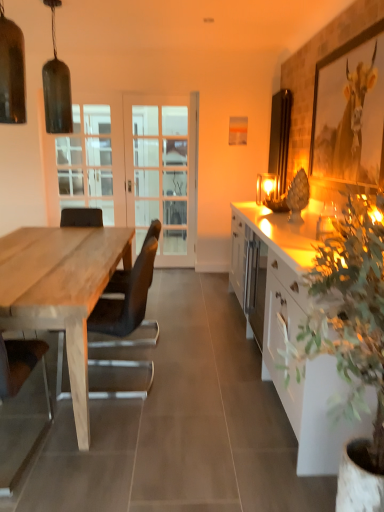
What do you see at coordinates (238, 130) in the screenshot? I see `matte wooden picture frame at upper center, which appears as the 2th picture frame when viewed from the front` at bounding box center [238, 130].

This screenshot has width=384, height=512. What do you see at coordinates (12, 72) in the screenshot? I see `matte glass pendant light at upper left, positioned as the 3th lamp in back-to-front order` at bounding box center [12, 72].

This screenshot has height=512, width=384. Describe the element at coordinates (127, 305) in the screenshot. I see `black leather chair at left, the 2th chair viewed from the front` at that location.

This screenshot has width=384, height=512. What do you see at coordinates (161, 173) in the screenshot?
I see `white glass screen door at center, which is the second screen door in left-to-right order` at bounding box center [161, 173].

You are a GUI agent. You are given a task and a screenshot of the screen. Output one action in this format:
    pyautogui.click(x=<x>, y=<y>)
    Task: Click on the clear glass door at center, marked as the 1th screen door in a left-to-right arrangement
    The width and height of the screenshot is (384, 512).
    Given the screenshot: What is the action you would take?
    pyautogui.click(x=135, y=168)

Identify the location of matte wooden picture frame at upper center, which appears as the 2th picture frame when viewed from the front. (238, 130).

Does white glossy cabinet at right appear on the left side of clear glass door at center, marked as the 1th screen door in a left-to-right arrangement?

No.

How distant is white glossy cabinet at right from clear glass door at center, which ranks as the 2th screen door in right-to-left order?

A distance of 7.39 feet exists between white glossy cabinet at right and clear glass door at center, which ranks as the 2th screen door in right-to-left order.

Which is in front, point (318, 474) or point (88, 190)?

The point (318, 474) is closer to the camera.

Considering the sizes of objects white glossy cabinet at right and clear glass door at center, which ranks as the 2th screen door in right-to-left order, in the image provided, who is shorter, white glossy cabinet at right or clear glass door at center, which ranks as the 2th screen door in right-to-left order,?

white glossy cabinet at right is shorter.

From the image's perspective, relative to metallic gold picture frame at upper right, acting as the second picture frame starting from the left, is matte glass pendant light at upper left, which is counted as the 2th lamp, starting from the right, above or below?

From the image's perspective, matte glass pendant light at upper left, which is counted as the 2th lamp, starting from the right, appears above metallic gold picture frame at upper right, acting as the second picture frame starting from the left.

Is metallic gold picture frame at upper right, positioned as the first picture frame in front-to-back order, at the back of matte glass pendant light at upper left, placed as the 1th lamp when sorted from front to back?

Yes.

From a real-world perspective, is matte glass pendant light at upper left, which is counted as the 2th lamp, starting from the right, on metallic gold picture frame at upper right, the 2th picture frame from the back?

Yes, from a real-world perspective, matte glass pendant light at upper left, which is counted as the 2th lamp, starting from the right, is on top of metallic gold picture frame at upper right, the 2th picture frame from the back.

From a real-world perspective, does matte glass lamp at upper right, the first lamp positioned from the right, stand above brown leather chair at left, acting as the first chair starting from the front?

Yes.

Looking at the image, does matte glass lamp at upper right, which is counted as the third lamp, starting from the front, seem bigger or smaller compared to brown leather chair at left, acting as the first chair starting from the front?

matte glass lamp at upper right, which is counted as the third lamp, starting from the front, is smaller than brown leather chair at left, acting as the first chair starting from the front.

Which object is closer to the camera taking this photo, matte glass lamp at upper right, the first lamp positioned from the right, or brown leather chair at left, acting as the first chair starting from the front?

brown leather chair at left, acting as the first chair starting from the front, is more forward.

Is matte glass lamp at upper right, the 3th lamp from the left, looking in the opposite direction of brown leather chair at left, acting as the first chair starting from the front?

No, matte glass lamp at upper right, the 3th lamp from the left, is not facing the opposite direction of brown leather chair at left, acting as the first chair starting from the front.

From the picture: What's the angular difference between brown leather chair at left, arranged as the second chair when viewed from the back, and clear glass door at center, marked as the 1th screen door in a left-to-right arrangement,'s facing directions?

There is a 179-degree angle between the facing directions of brown leather chair at left, arranged as the second chair when viewed from the back, and clear glass door at center, marked as the 1th screen door in a left-to-right arrangement.

Is brown leather chair at left, acting as the first chair starting from the front, positioned far away from clear glass door at center, marked as the 1th screen door in a left-to-right arrangement?

Yes, brown leather chair at left, acting as the first chair starting from the front, and clear glass door at center, marked as the 1th screen door in a left-to-right arrangement, are quite far apart.

How far apart are brown leather chair at left, acting as the first chair starting from the front, and clear glass door at center, marked as the 1th screen door in a left-to-right arrangement?

brown leather chair at left, acting as the first chair starting from the front, is 3.27 meters from clear glass door at center, marked as the 1th screen door in a left-to-right arrangement.

Which of these two, brown leather chair at left, arranged as the second chair when viewed from the back, or clear glass door at center, marked as the 1th screen door in a left-to-right arrangement, is wider?

brown leather chair at left, arranged as the second chair when viewed from the back.

Is matte wooden picture frame at upper center, the first picture frame in the left-to-right sequence, turned away from clear glass door at center, marked as the 1th screen door in a left-to-right arrangement?

matte wooden picture frame at upper center, the first picture frame in the left-to-right sequence, does not have its back to clear glass door at center, marked as the 1th screen door in a left-to-right arrangement.

From a real-world perspective, which object rests below the other?

clear glass door at center, marked as the 1th screen door in a left-to-right arrangement, is physically lower.

Is matte wooden picture frame at upper center, which appears as the 2th picture frame when viewed from the front, to the left of clear glass door at center, marked as the 1th screen door in a left-to-right arrangement, from the viewer's perspective?

In fact, matte wooden picture frame at upper center, which appears as the 2th picture frame when viewed from the front, is to the right of clear glass door at center, marked as the 1th screen door in a left-to-right arrangement.

Does matte wooden picture frame at upper center, which appears as the 2th picture frame when viewed from the front, touch clear glass door at center, which ranks as the 2th screen door in right-to-left order?

matte wooden picture frame at upper center, which appears as the 2th picture frame when viewed from the front, and clear glass door at center, which ranks as the 2th screen door in right-to-left order, are not in contact.

Considering the relative positions of black leather chair at left, the 2th chair viewed from the front, and clear glass door at center, marked as the 1th screen door in a left-to-right arrangement, in the image provided, is black leather chair at left, the 2th chair viewed from the front, to the right of clear glass door at center, marked as the 1th screen door in a left-to-right arrangement, from the viewer's perspective?

Indeed, black leather chair at left, the 2th chair viewed from the front, is positioned on the right side of clear glass door at center, marked as the 1th screen door in a left-to-right arrangement.

In terms of size, does black leather chair at left, the 2th chair viewed from the front, appear bigger or smaller than clear glass door at center, which ranks as the 2th screen door in right-to-left order?

Clearly, black leather chair at left, the 2th chair viewed from the front, is smaller in size than clear glass door at center, which ranks as the 2th screen door in right-to-left order.

From the image's perspective, between black leather chair at left, the 1th chair positioned from the back, and clear glass door at center, which ranks as the 2th screen door in right-to-left order, who is located below?

black leather chair at left, the 1th chair positioned from the back, is shown below in the image.

Is point (90, 326) positioned in front of point (155, 137)?

Yes.

This screenshot has width=384, height=512. Identify the location of chair that is the 2nd one when counting downward from the matte wooden picture frame at upper center, which appears as the 2th picture frame when viewed from the front (from the image's perspective). (21, 366).

How much distance is there between brown leather chair at left, arranged as the second chair when viewed from the back, and matte wooden picture frame at upper center, the first picture frame in the left-to-right sequence?

The distance of brown leather chair at left, arranged as the second chair when viewed from the back, from matte wooden picture frame at upper center, the first picture frame in the left-to-right sequence, is 11.58 feet.

Would you say brown leather chair at left, placed as the second chair when sorted from right to left, is outside matte wooden picture frame at upper center, the first picture frame in the left-to-right sequence?

Absolutely, brown leather chair at left, placed as the second chair when sorted from right to left, is external to matte wooden picture frame at upper center, the first picture frame in the left-to-right sequence.

Are brown leather chair at left, arranged as the second chair when viewed from the back, and matte wooden picture frame at upper center, the first picture frame in the left-to-right sequence, located far from each other?

That's right, there is a large distance between brown leather chair at left, arranged as the second chair when viewed from the back, and matte wooden picture frame at upper center, the first picture frame in the left-to-right sequence.

Identify the location of cabinetry in front of the clear glass door at center, marked as the 1th screen door in a left-to-right arrangement. (294, 340).

Locate an element on the screen. This screenshot has height=512, width=384. the 1st lamp located above the metallic gold picture frame at upper right, positioned as the first picture frame in front-to-back order (from a real-world perspective) is located at coordinates (12, 72).

Which object lies further to the anchor point metallic gold picture frame at upper right, the 2th picture frame from the back, matte wooden picture frame at upper center, the first picture frame in the left-to-right sequence, or white glass screen door at center, arranged as the first screen door when viewed from the right?

Among the two, white glass screen door at center, arranged as the first screen door when viewed from the right, is located further to metallic gold picture frame at upper right, the 2th picture frame from the back.

Based on their spatial positions, is matte glass pendant light at upper left, which is counted as the 2th lamp, starting from the right, or clear glass door at center, which ranks as the 2th screen door in right-to-left order, further from natural wood table at left?

clear glass door at center, which ranks as the 2th screen door in right-to-left order, lies further to natural wood table at left than the other object.

Looking at the image, which one is located further to brown leather chair at left, acting as the first chair starting from the front, matte glass pendant light at upper left, placed as the 1th lamp when sorted from front to back, or black leather chair at left, marked as the 1th chair in a right-to-left arrangement?

Based on the image, matte glass pendant light at upper left, placed as the 1th lamp when sorted from front to back, appears to be further to brown leather chair at left, acting as the first chair starting from the front.

Based on their spatial positions, is matte glass pendant light at upper left, marked as the first lamp in a left-to-right arrangement, or brown leather chair at left, arranged as the second chair when viewed from the back, closer to matte glass pendant light at upper left, the second lamp when ordered from left to right?

The object closer to matte glass pendant light at upper left, the second lamp when ordered from left to right, is matte glass pendant light at upper left, marked as the first lamp in a left-to-right arrangement.

Which object lies further to the anchor point metallic gold picture frame at upper right, positioned as the first picture frame in front-to-back order, natural wood table at left or matte glass pendant light at upper left, which is the 3th lamp from right to left?

Among the two, matte glass pendant light at upper left, which is the 3th lamp from right to left, is located further to metallic gold picture frame at upper right, positioned as the first picture frame in front-to-back order.

Considering their positions, is natural wood table at left positioned closer to matte wooden picture frame at upper center, the first picture frame in the left-to-right sequence, than white glass screen door at center, arranged as the first screen door when viewed from the right?

white glass screen door at center, arranged as the first screen door when viewed from the right, is closer to matte wooden picture frame at upper center, the first picture frame in the left-to-right sequence.

When comparing their distances from matte glass lamp at upper right, the first lamp in the back-to-front sequence, does matte glass pendant light at upper left, the second lamp when ordered from left to right, or matte glass pendant light at upper left, the second lamp viewed from the front, seem further?

matte glass pendant light at upper left, the second lamp when ordered from left to right, is further to matte glass lamp at upper right, the first lamp in the back-to-front sequence.

When comparing their distances from white glossy cabinet at right, does metallic gold picture frame at upper right, acting as the second picture frame starting from the left, or matte glass pendant light at upper left, the second lamp viewed from the front, seem closer?

Based on the image, metallic gold picture frame at upper right, acting as the second picture frame starting from the left, appears to be nearer to white glossy cabinet at right.

The height and width of the screenshot is (512, 384). I want to click on chair positioned between matte glass pendant light at upper left, placed as the 1th lamp when sorted from front to back, and matte wooden picture frame at upper center, which appears as the 2th picture frame when viewed from the front, from near to far, so click(127, 305).

This screenshot has height=512, width=384. Find the location of `lamp between matte glass pendant light at upper left, which is the 3th lamp from right to left, and matte glass lamp at upper right, the first lamp positioned from the right, in the horizontal direction`. lamp between matte glass pendant light at upper left, which is the 3th lamp from right to left, and matte glass lamp at upper right, the first lamp positioned from the right, in the horizontal direction is located at coordinates (12, 72).

This screenshot has height=512, width=384. Find the location of `screen door between natural wood table at left and white glass screen door at center, arranged as the first screen door when viewed from the right, along the z-axis`. screen door between natural wood table at left and white glass screen door at center, arranged as the first screen door when viewed from the right, along the z-axis is located at coordinates (135, 168).

Identify the location of desk between matte glass pendant light at upper left, placed as the 2th lamp when sorted from back to front, and matte glass lamp at upper right, which is counted as the third lamp, starting from the front. (60, 291).